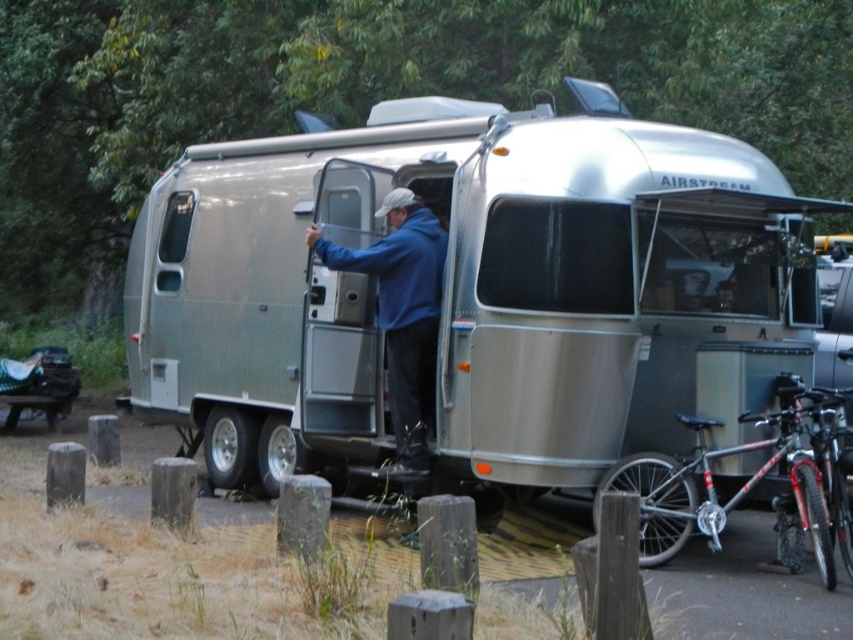
Does silver metallic trailer at center lie behind blue matte jacket at center?

Yes, silver metallic trailer at center is behind blue matte jacket at center.

Which is below, silver metallic trailer at center or blue matte jacket at center?

Positioned lower is blue matte jacket at center.

This screenshot has width=853, height=640. In order to click on silver metallic trailer at center in this screenshot , I will do point(463,289).

You are a GUI agent. You are given a task and a screenshot of the screen. Output one action in this format:
    pyautogui.click(x=<x>, y=<y>)
    Task: Click on the silver metallic trailer at center
    
    Given the screenshot: What is the action you would take?
    pyautogui.click(x=463, y=289)